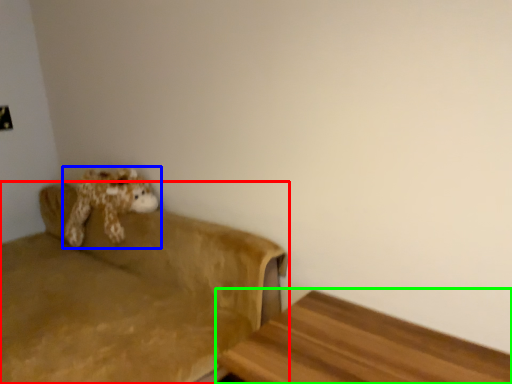
Question: Based on their relative distances, which object is farther from studio couch (highlighted by a red box)? Choose from toy (highlighted by a blue box) and furniture (highlighted by a green box).

Choices:
 (A) toy
 (B) furniture

Answer: (B)